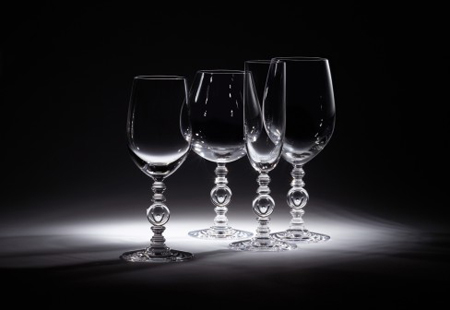
Image resolution: width=450 pixels, height=310 pixels. Find the location of `wine glasses`. wine glasses is located at coordinates (152, 140), (210, 133), (266, 127), (311, 122).